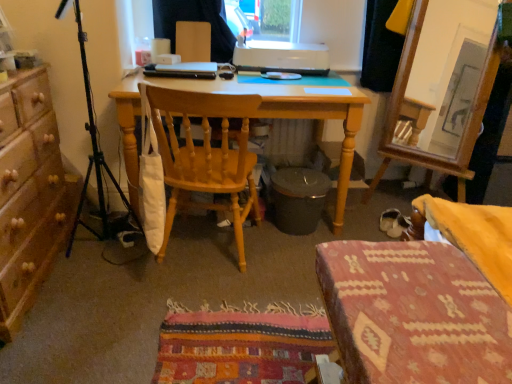
Locate an element on the screen. The height and width of the screenshot is (384, 512). vacant area that lies in front of wooden chair at center is located at coordinates (198, 312).